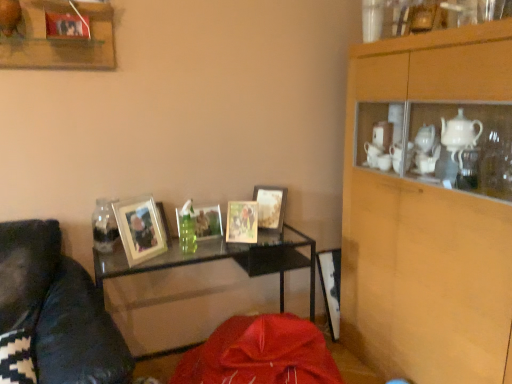
Question: Are clear glass jar at left and wooden cabinet at upper right far apart?

Choices:
 (A) no
 (B) yes

Answer: (B)

Question: Is clear glass jar at left oriented away from wooden cabinet at upper right?

Choices:
 (A) no
 (B) yes

Answer: (A)

Question: From the image's perspective, would you say clear glass jar at left is positioned over wooden cabinet at upper right?

Choices:
 (A) no
 (B) yes

Answer: (B)

Question: From a real-world perspective, is clear glass jar at left under wooden cabinet at upper right?

Choices:
 (A) yes
 (B) no

Answer: (B)

Question: Is clear glass jar at left thinner than wooden cabinet at upper right?

Choices:
 (A) no
 (B) yes

Answer: (B)

Question: Considering the relative sizes of clear glass jar at left and wooden cabinet at upper right in the image provided, is clear glass jar at left taller than wooden cabinet at upper right?

Choices:
 (A) no
 (B) yes

Answer: (A)

Question: Is matte wooden picture frame at center, which ranks as the 2th picture frame in right-to-left order, taller than clear glass table at center?

Choices:
 (A) no
 (B) yes

Answer: (A)

Question: From a real-world perspective, is matte wooden picture frame at center, which ranks as the 2th picture frame in right-to-left order, over clear glass table at center?

Choices:
 (A) no
 (B) yes

Answer: (B)

Question: Would you consider matte wooden picture frame at center, which ranks as the 2th picture frame in right-to-left order, to be distant from clear glass table at center?

Choices:
 (A) yes
 (B) no

Answer: (B)

Question: Is matte wooden picture frame at center, which is the 3th picture frame from left to right, positioned in front of clear glass table at center?

Choices:
 (A) yes
 (B) no

Answer: (B)

Question: Is clear glass table at center a part of matte wooden picture frame at center, which ranks as the 2th picture frame in right-to-left order?

Choices:
 (A) yes
 (B) no

Answer: (B)

Question: From the image's perspective, is matte wooden picture frame at center, which ranks as the 2th picture frame in right-to-left order, beneath clear glass table at center?

Choices:
 (A) yes
 (B) no

Answer: (B)

Question: Can you confirm if wooden frame at upper left is taller than matte silver picture frame at center-left, acting as the fourth picture frame starting from the right?

Choices:
 (A) no
 (B) yes

Answer: (B)